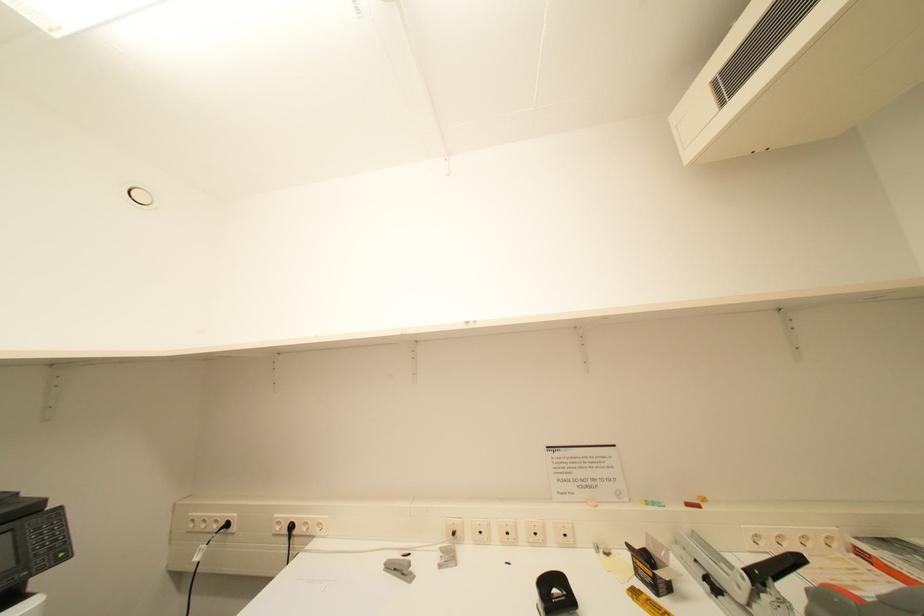
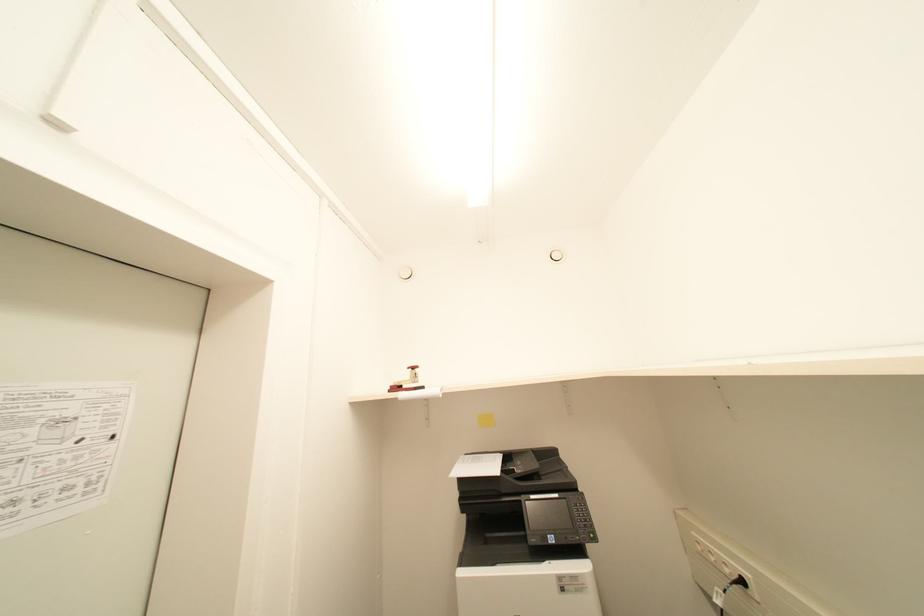
Question: Based on the continuous images, in which direction is the camera rotating? Reply with the corresponding letter.

Choices:
 (A) Left
 (B) Right
 (C) Up
 (D) Down

Answer: (A)